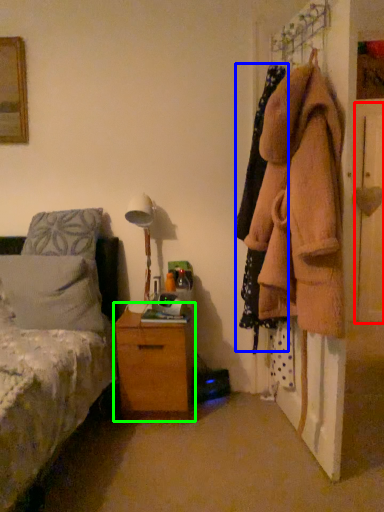
Question: Based on their relative distances, which object is nearer to door (highlighted by a red box)? Choose from clothing (highlighted by a blue box) and chest of drawers (highlighted by a green box).

Choices:
 (A) clothing
 (B) chest of drawers

Answer: (A)